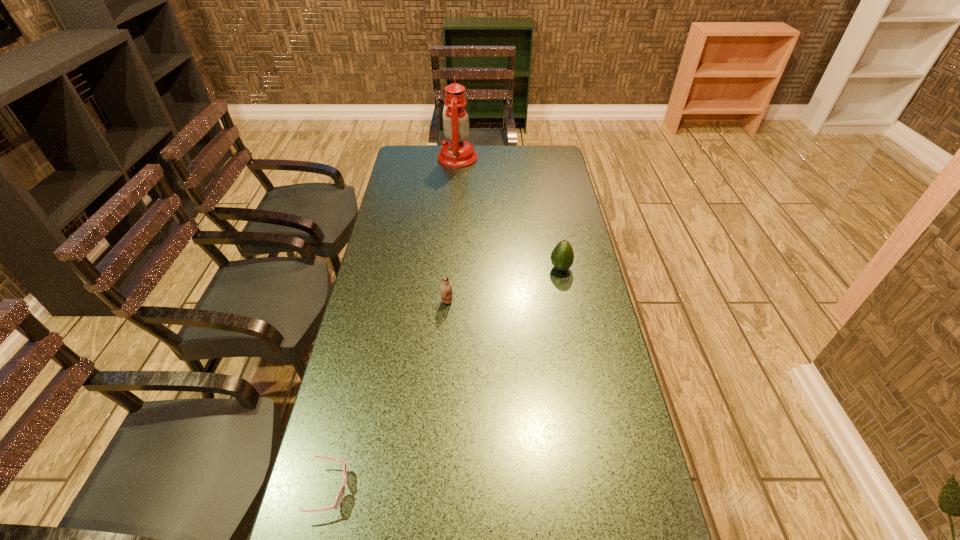
Locate an element on the screen. Image resolution: width=960 pixels, height=540 pixels. free region located on the front-facing side of the sunglasses is located at coordinates (442, 489).

Find the location of a particular element. The width and height of the screenshot is (960, 540). object that is positioned at the far edge is located at coordinates (457, 152).

You are a GUI agent. You are given a task and a screenshot of the screen. Output one action in this format:
    pyautogui.click(x=<x>, y=<y>)
    Task: Click on the object positioned at the left edge
    The width and height of the screenshot is (960, 540).
    Given the screenshot: What is the action you would take?
    pyautogui.click(x=339, y=498)

The width and height of the screenshot is (960, 540). I want to click on object that is positioned at the right edge, so click(562, 257).

In the image, there is a desktop. Identify the location of free space at the far edge. (485, 151).

The height and width of the screenshot is (540, 960). I want to click on free point at the left edge, so click(x=367, y=313).

In the image, there is a desktop. Where is `vacant space at the right edge`? The width and height of the screenshot is (960, 540). vacant space at the right edge is located at coordinates (635, 461).

In the image, there is a desktop. In order to click on free space at the far left corner in this screenshot , I will do `click(419, 151)`.

Identify the location of free spot between the second nearest object and the shortest object. (389, 395).

Where is `vacant area between the oil lamp and the second nearest object`? Image resolution: width=960 pixels, height=540 pixels. vacant area between the oil lamp and the second nearest object is located at coordinates (452, 230).